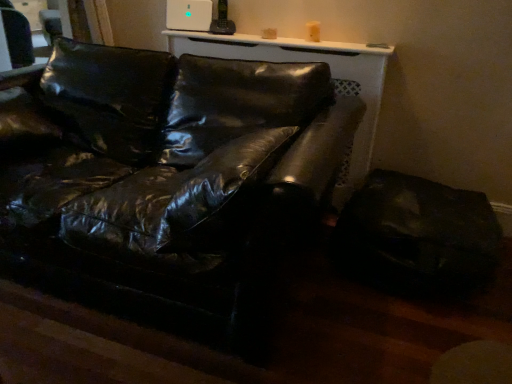
You are a GUI agent. You are given a task and a screenshot of the screen. Output one action in this format:
    pyautogui.click(x=<x>, y=<y>)
    Task: Click on the empty space that is in between shiny black leather swivel chair at lower right and glossy black leather couch at center
    The width and height of the screenshot is (512, 384).
    Given the screenshot: What is the action you would take?
    pyautogui.click(x=373, y=332)